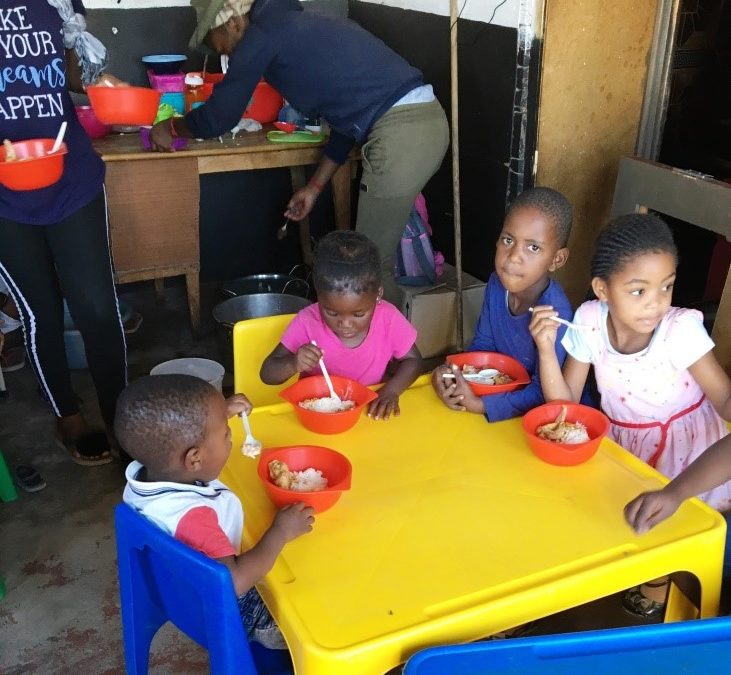
You are a GUI agent. You are given a task and a screenshot of the screen. Output one action in this format:
    pyautogui.click(x=<x>, y=<y>)
    Task: Click on the blue chair
    This screenshot has width=731, height=675.
    Given the screenshot: What is the action you would take?
    pyautogui.click(x=623, y=644)